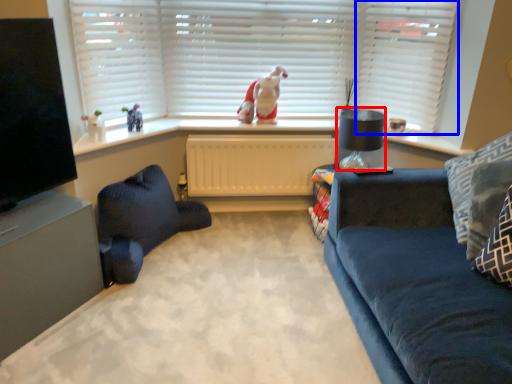
Question: Which of the following is the farthest to the observer, lamp (highlighted by a red box) or shutter (highlighted by a blue box)?

Choices:
 (A) lamp
 (B) shutter

Answer: (A)